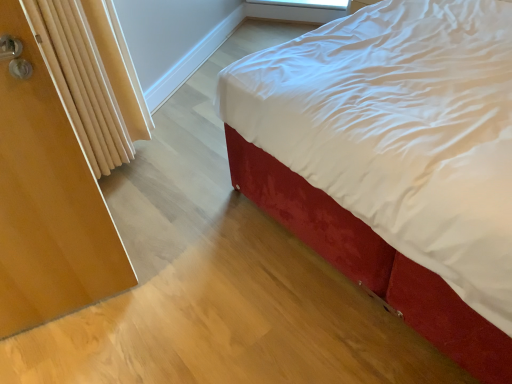
In order to face wooden radiator at left, should I rotate leftwards or rightwards?

Turn left approximately 21.823 degrees to face it.

Image resolution: width=512 pixels, height=384 pixels. Describe the element at coordinates (306, 3) in the screenshot. I see `transparent plastic window screen at upper center` at that location.

The width and height of the screenshot is (512, 384). What do you see at coordinates (48, 202) in the screenshot?
I see `wooden screen door at left` at bounding box center [48, 202].

Where is `wooden screen door at left`? This screenshot has width=512, height=384. wooden screen door at left is located at coordinates (48, 202).

The image size is (512, 384). I want to click on wooden radiator at left, so click(x=82, y=81).

The width and height of the screenshot is (512, 384). In order to click on bed in front of the transparent plastic window screen at upper center in this screenshot , I will do `click(390, 157)`.

Is velvet red bed at center to the right of transparent plastic window screen at upper center from the viewer's perspective?

Correct, you'll find velvet red bed at center to the right of transparent plastic window screen at upper center.

Is velvet red bed at center not inside transparent plastic window screen at upper center?

Yes, velvet red bed at center is located beyond the bounds of transparent plastic window screen at upper center.

From a real-world perspective, does velvet red bed at center sit lower than transparent plastic window screen at upper center?

No.

How different are the orientations of velvet red bed at center and wooden screen door at left in degrees?

velvet red bed at center and wooden screen door at left are facing 76.1 degrees away from each other.

Is velvet red bed at center not close to wooden screen door at left?

They are positioned close to each other.

Is velvet red bed at center positioned behind wooden screen door at left?

No, velvet red bed at center is in front of wooden screen door at left.

Can you confirm if velvet red bed at center is positioned to the left of wooden screen door at left?

Incorrect, velvet red bed at center is not on the left side of wooden screen door at left.

Is wooden radiator at left facing towards transparent plastic window screen at upper center?

No, wooden radiator at left is not aimed at transparent plastic window screen at upper center.

Which point is more distant from viewer, [111,89] or [315,7]?

The point [315,7] is behind.

Would you say wooden radiator at left is to the left or to the right of transparent plastic window screen at upper center in the picture?

From the image, it's evident that wooden radiator at left is to the left of transparent plastic window screen at upper center.

Measure the distance from wooden radiator at left to transparent plastic window screen at upper center.

wooden radiator at left and transparent plastic window screen at upper center are 6.42 feet apart from each other.

Looking at this image, is wooden screen door at left surrounding wooden radiator at left?

No, wooden radiator at left is located outside of wooden screen door at left.

Considering the sizes of objects wooden screen door at left and wooden radiator at left in the image provided, who is bigger, wooden screen door at left or wooden radiator at left?

With larger size is wooden radiator at left.

From the picture: Which object is more forward, wooden screen door at left or wooden radiator at left?

wooden screen door at left.

Locate an element on the screen. screen door below the wooden radiator at left (from the image's perspective) is located at coordinates (48, 202).

Is transparent plastic window screen at upper center turned away from wooden radiator at left?

transparent plastic window screen at upper center is not turned away from wooden radiator at left.

Does point (282, 4) appear closer or farther from the camera than point (35, 19)?

Point (282, 4) is positioned farther from the camera compared to point (35, 19).

Are transparent plastic window screen at upper center and wooden radiator at left located far from each other?

transparent plastic window screen at upper center is far away from wooden radiator at left.

Which object is closer to the camera taking this photo, transparent plastic window screen at upper center or wooden radiator at left?

wooden radiator at left is closer to the camera.

How many degrees apart are the facing directions of wooden screen door at left and transparent plastic window screen at upper center?

The angular difference between wooden screen door at left and transparent plastic window screen at upper center is 46.2 degrees.

From a real-world perspective, does wooden screen door at left stand above transparent plastic window screen at upper center?

Yes, from a real-world perspective, wooden screen door at left is over transparent plastic window screen at upper center

Who is smaller, wooden screen door at left or transparent plastic window screen at upper center?

transparent plastic window screen at upper center.

Is transparent plastic window screen at upper center completely or partially inside wooden screen door at left?

Actually, transparent plastic window screen at upper center is outside wooden screen door at left.

Is transparent plastic window screen at upper center facing away from wooden screen door at left?

No, transparent plastic window screen at upper center is not facing away from wooden screen door at left.

Would you say transparent plastic window screen at upper center is a long distance from wooden screen door at left?

Yes, transparent plastic window screen at upper center is far from wooden screen door at left.

Is transparent plastic window screen at upper center taller or shorter than wooden screen door at left?

transparent plastic window screen at upper center is shorter than wooden screen door at left.

Considering the sizes of transparent plastic window screen at upper center and wooden screen door at left in the image, is transparent plastic window screen at upper center wider or thinner than wooden screen door at left?

Considering their sizes, transparent plastic window screen at upper center looks broader than wooden screen door at left.

This screenshot has height=384, width=512. I want to click on bed lying in front of the transparent plastic window screen at upper center, so click(x=390, y=157).

This screenshot has width=512, height=384. In order to click on screen door located below the velvet red bed at center (from the image's perspective) in this screenshot , I will do `click(48, 202)`.

Considering their positions, is wooden screen door at left positioned further to velvet red bed at center than wooden radiator at left?

Among the two, wooden radiator at left is located further to velvet red bed at center.

From the image, which object appears to be farther from wooden radiator at left, wooden screen door at left or transparent plastic window screen at upper center?

transparent plastic window screen at upper center is positioned further to the anchor wooden radiator at left.

Estimate the real-world distances between objects in this image. Which object is further from wooden radiator at left, velvet red bed at center or transparent plastic window screen at upper center?

Among the two, transparent plastic window screen at upper center is located further to wooden radiator at left.

Looking at the image, which one is located closer to wooden screen door at left, velvet red bed at center or wooden radiator at left?

wooden radiator at left is closer to wooden screen door at left.

Considering their positions, is transparent plastic window screen at upper center positioned further to wooden radiator at left than wooden screen door at left?

transparent plastic window screen at upper center.

Looking at the image, which one is located closer to wooden screen door at left, wooden radiator at left or velvet red bed at center?

Based on the image, wooden radiator at left appears to be nearer to wooden screen door at left.

When comparing their distances from wooden screen door at left, does velvet red bed at center or transparent plastic window screen at upper center seem further?

The object further to wooden screen door at left is transparent plastic window screen at upper center.

Based on their spatial positions, is wooden screen door at left or velvet red bed at center closer to transparent plastic window screen at upper center?

velvet red bed at center is closer to transparent plastic window screen at upper center.

Find the location of a particular element. Image resolution: width=512 pixels, height=384 pixels. radiator positioned between velvet red bed at center and transparent plastic window screen at upper center from near to far is located at coordinates (82, 81).

The image size is (512, 384). What are the coordinates of `screen door between wooden radiator at left and velvet red bed at center in the horizontal direction` in the screenshot? It's located at (48, 202).

This screenshot has height=384, width=512. What are the coordinates of `screen door between velvet red bed at center and transparent plastic window screen at upper center from front to back` in the screenshot? It's located at tap(48, 202).

Locate an element on the screen. This screenshot has height=384, width=512. radiator between wooden screen door at left and transparent plastic window screen at upper center in the front-back direction is located at coordinates (82, 81).